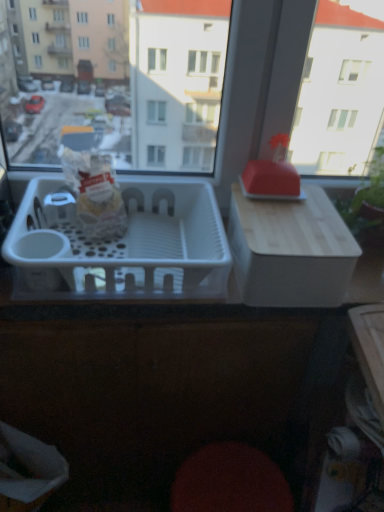
Question: Considering the relative sizes of matte white bag at center and green leafy plant at upper right in the image provided, is matte white bag at center bigger than green leafy plant at upper right?

Choices:
 (A) yes
 (B) no

Answer: (B)

Question: Is matte white bag at center to the left of green leafy plant at upper right from the viewer's perspective?

Choices:
 (A) no
 (B) yes

Answer: (B)

Question: Does matte white bag at center have a lesser height compared to green leafy plant at upper right?

Choices:
 (A) yes
 (B) no

Answer: (A)

Question: Is green leafy plant at upper right a part of matte white bag at center?

Choices:
 (A) yes
 (B) no

Answer: (B)

Question: From the image's perspective, does matte white bag at center appear lower than green leafy plant at upper right?

Choices:
 (A) no
 (B) yes

Answer: (A)

Question: Is matte white bag at center outside green leafy plant at upper right?

Choices:
 (A) yes
 (B) no

Answer: (A)

Question: Is white plastic basket at center taller than green leafy plant at upper right?

Choices:
 (A) no
 (B) yes

Answer: (A)

Question: Is white plastic basket at center wider than green leafy plant at upper right?

Choices:
 (A) no
 (B) yes

Answer: (B)

Question: Considering the relative sizes of white plastic basket at center and green leafy plant at upper right in the image provided, is white plastic basket at center bigger than green leafy plant at upper right?

Choices:
 (A) yes
 (B) no

Answer: (A)

Question: From a real-world perspective, is white plastic basket at center located higher than green leafy plant at upper right?

Choices:
 (A) yes
 (B) no

Answer: (B)

Question: Is white plastic basket at center next to green leafy plant at upper right and touching it?

Choices:
 (A) yes
 (B) no

Answer: (B)

Question: Can we say white plastic basket at center lies outside green leafy plant at upper right?

Choices:
 (A) yes
 (B) no

Answer: (A)

Question: Is green leafy plant at upper right closer to the viewer compared to matte white bag at center?

Choices:
 (A) no
 (B) yes

Answer: (A)